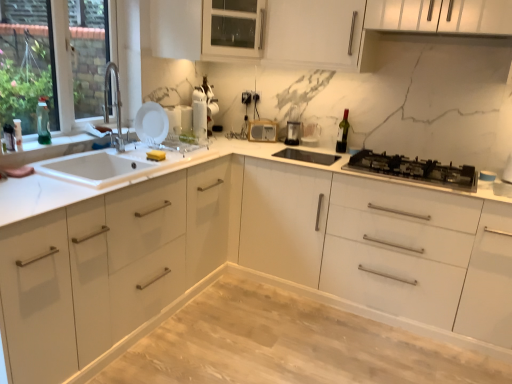
Question: From the image's perspective, is white matte plate at upper left, marked as the first appliance in a left-to-right arrangement, located beneath green glass bottle at left, the 2th bottle from the front?

Choices:
 (A) no
 (B) yes

Answer: (A)

Question: Is the depth of white matte plate at upper left, marked as the first appliance in a left-to-right arrangement, greater than that of green glass bottle at left, arranged as the 2th bottle when viewed from the left?

Choices:
 (A) no
 (B) yes

Answer: (B)

Question: From a real-world perspective, is white matte plate at upper left, the 4th appliance positioned from the right, beneath green glass bottle at left, the 2th bottle from the front?

Choices:
 (A) yes
 (B) no

Answer: (A)

Question: Is white matte plate at upper left, which is counted as the fourth appliance, starting from the back, positioned before green glass bottle at left, the 1th bottle positioned from the right?

Choices:
 (A) yes
 (B) no

Answer: (B)

Question: Is white matte plate at upper left, the 4th appliance positioned from the right, thinner than green glass bottle at left, which ranks as the first bottle in back-to-front order?

Choices:
 (A) yes
 (B) no

Answer: (A)

Question: Would you say white matte plate at upper left, the 4th appliance positioned from the right, is outside green glass bottle at left, arranged as the 2th bottle when viewed from the left?

Choices:
 (A) no
 (B) yes

Answer: (B)

Question: Is clear glass window at left to the right of translucent plastic bottle at left, the first bottle viewed from the left, from the viewer's perspective?

Choices:
 (A) yes
 (B) no

Answer: (A)

Question: Considering the relative sizes of clear glass window at left and translucent plastic bottle at left, the first bottle when ordered from front to back, in the image provided, is clear glass window at left smaller than translucent plastic bottle at left, the first bottle when ordered from front to back,?

Choices:
 (A) yes
 (B) no

Answer: (B)

Question: From a real-world perspective, is clear glass window at left physically below translucent plastic bottle at left, which is counted as the second bottle, starting from the right?

Choices:
 (A) yes
 (B) no

Answer: (B)

Question: From the image's perspective, does clear glass window at left appear lower than translucent plastic bottle at left, acting as the 2th bottle starting from the back?

Choices:
 (A) yes
 (B) no

Answer: (B)

Question: Does clear glass window at left have a lesser height compared to translucent plastic bottle at left, the first bottle viewed from the left?

Choices:
 (A) no
 (B) yes

Answer: (A)

Question: Is clear glass window at left taller than translucent plastic bottle at left, which is counted as the second bottle, starting from the right?

Choices:
 (A) no
 (B) yes

Answer: (B)

Question: Does light wood/dark stain dining table at center lie in front of green glass wine bottle at upper right?

Choices:
 (A) no
 (B) yes

Answer: (B)